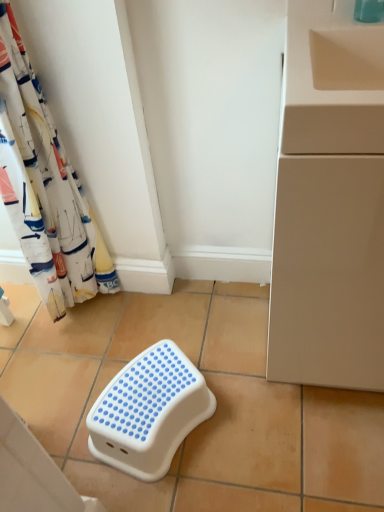
Where is `unoccupied space behind white plastic step stool at center`? This screenshot has height=512, width=384. unoccupied space behind white plastic step stool at center is located at coordinates (167, 331).